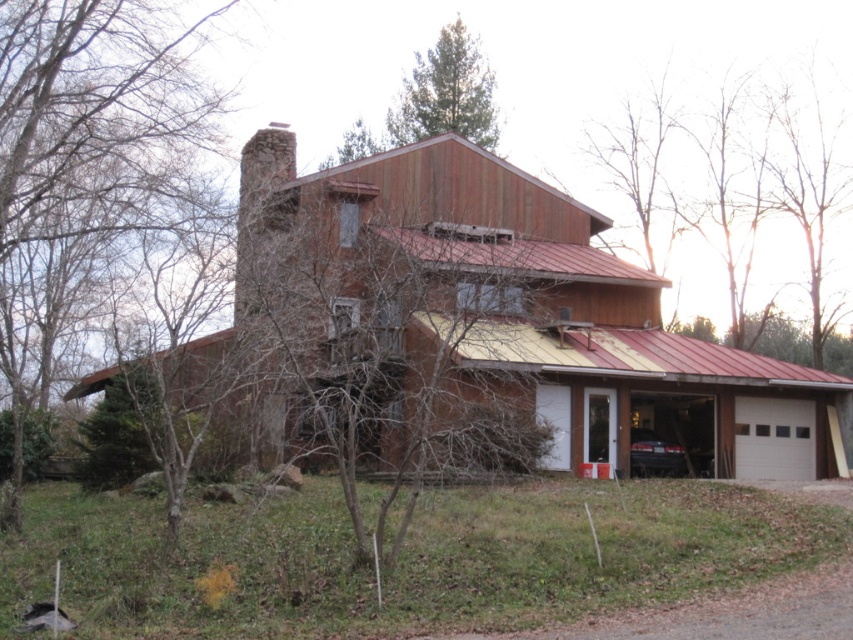
Can you confirm if green leafy tree at left is positioned below green textured pine tree at upper center?

Indeed, green leafy tree at left is positioned under green textured pine tree at upper center.

Between green leafy tree at left and green textured pine tree at upper center, which one appears on the left side from the viewer's perspective?

From the viewer's perspective, green leafy tree at left appears more on the left side.

Is point (24, 3) positioned behind point (404, 96)?

No, (24, 3) is in front of (404, 96).

Identify the location of green leafy tree at left. The width and height of the screenshot is (853, 640). (88, 161).